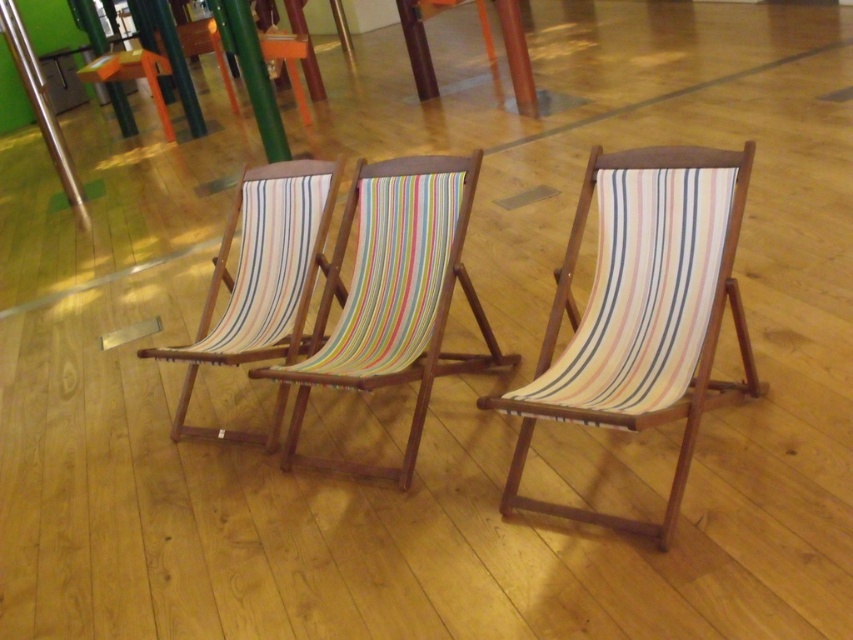
You are standing at the entrance of the room and want to move towards the multicolored striped fabric deck chair at center. Which direction should you walk relative to the green wood pole at center?

You should walk to the right of the green wood pole at center to reach the multicolored striped fabric deck chair at center since it is positioned to the right of the pole.

You are standing at the center of the room and want to move towards the brushed metal pole at upper left. Which direction should you face to walk straight towards it?

You should face the upper left direction to walk straight towards the brushed metal pole at upper left since it is located at point (41, 106), which is in the upper left area of the image.

You are standing at the entrance of the room and want to move towards the green wood pole at center. Which direction should you move relative to the brushed metal pole at upper left?

You should move to the right relative to the brushed metal pole at upper left because the green wood pole at center is to the right of it.